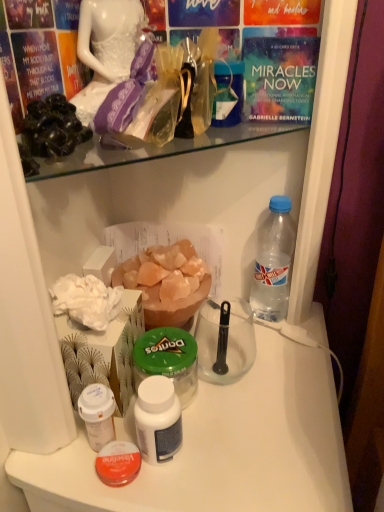
Identify the location of free point to the right of green plastic jar at center, which ranks as the third bottle in left-to-right order. (266, 403).